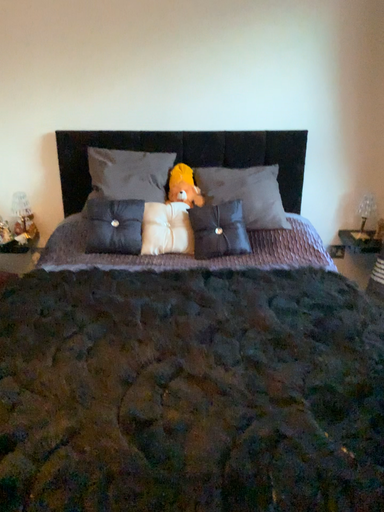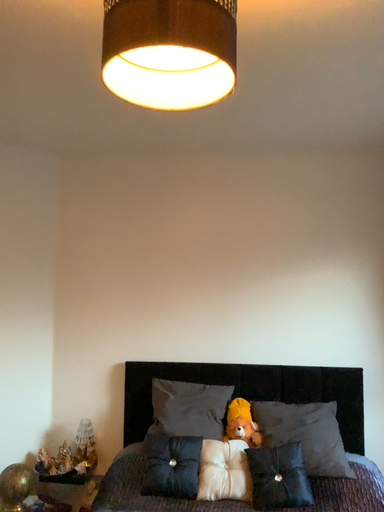
Question: Which way did the camera rotate in the video?

Choices:
 (A) rotated downward
 (B) rotated upward

Answer: (B)